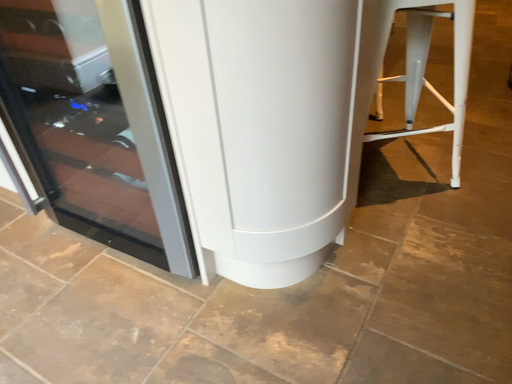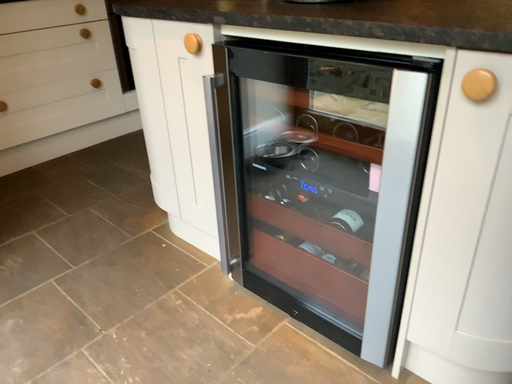
Question: How did the camera likely rotate when shooting the video?

Choices:
 (A) rotated left
 (B) rotated right

Answer: (A)